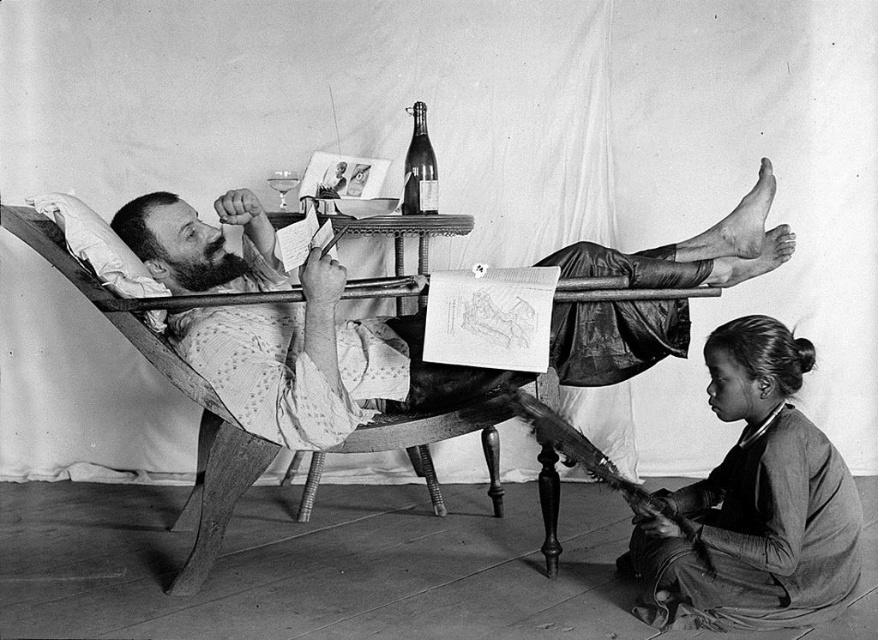
How far apart are smooth dark fabric at lower right and shiny glass bottle at center?

4.73 feet

Between smooth dark fabric at lower right and shiny glass bottle at center, which one appears on the right side from the viewer's perspective?

smooth dark fabric at lower right is more to the right.

This screenshot has height=640, width=878. In order to click on smooth dark fabric at lower right in this screenshot , I will do `click(753, 500)`.

Where is `smooth dark fabric at lower right`? The height and width of the screenshot is (640, 878). smooth dark fabric at lower right is located at coordinates (753, 500).

Between point (240, 202) and point (812, 548), which one is positioned in front?

Positioned in front is point (812, 548).

Is spotted cotton shirt at center smaller than smooth dark fabric at lower right?

Actually, spotted cotton shirt at center might be larger than smooth dark fabric at lower right.

Is point (650, 330) closer to viewer compared to point (799, 472)?

No.

Locate an element on the screen. Image resolution: width=878 pixels, height=640 pixels. spotted cotton shirt at center is located at coordinates (318, 364).

Which of these two, spotted cotton shirt at center or shiny glass bottle at center, stands taller?

spotted cotton shirt at center

Can you confirm if spotted cotton shirt at center is thinner than shiny glass bottle at center?

No.

Describe the element at coordinates (318, 364) in the screenshot. I see `spotted cotton shirt at center` at that location.

Locate an element on the screen. spotted cotton shirt at center is located at coordinates (318, 364).